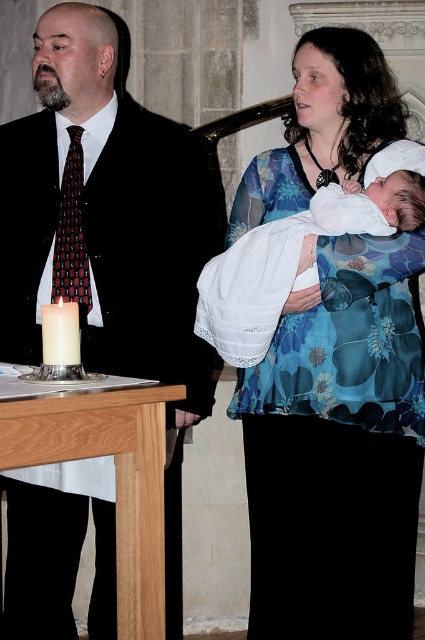
Does matte black suit at left appear on the right side of dark red textured tie at left?

Yes, matte black suit at left is to the right of dark red textured tie at left.

Does matte black suit at left appear under dark red textured tie at left?

Yes, matte black suit at left is below dark red textured tie at left.

Who is more forward, (x=184, y=419) or (x=85, y=284)?

Point (x=85, y=284)

The height and width of the screenshot is (640, 425). What are the coordinates of `matte black suit at left` in the screenshot? It's located at click(x=105, y=214).

From the picture: Does matte black suit at left have a larger size compared to white wax candle at lower left?

Correct, matte black suit at left is larger in size than white wax candle at lower left.

Which is above, matte black suit at left or white wax candle at lower left?

matte black suit at left is higher up.

Who is more forward, (156, 212) or (44, 339)?

Point (44, 339) is more forward.

Identify the location of matte black suit at left. (105, 214).

Can you confirm if blue floral dress at center is positioned below dark red textured tie at left?

Correct, blue floral dress at center is located below dark red textured tie at left.

Is point (337, 566) less distant than point (71, 144)?

Yes, it is.

Find the location of a particular element. blue floral dress at center is located at coordinates (337, 449).